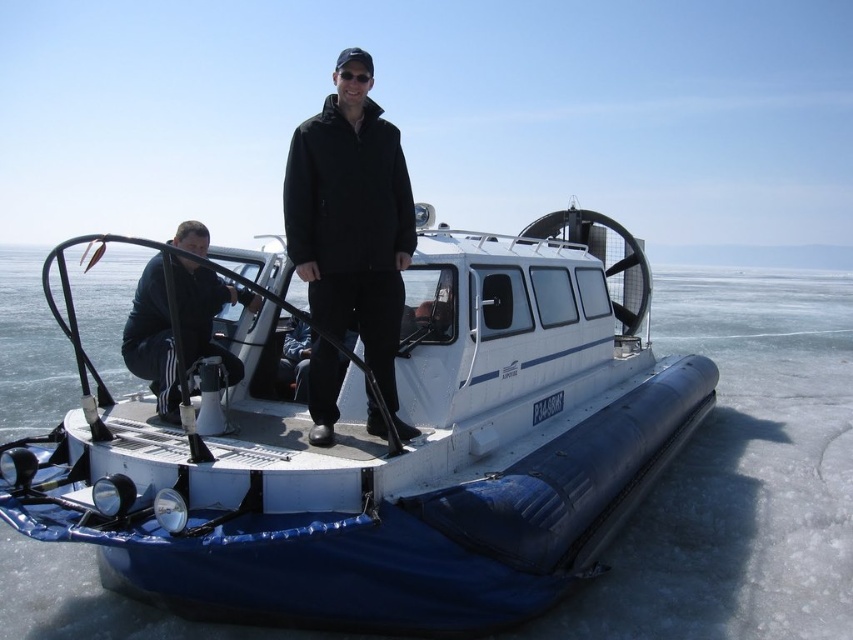
Question: Is black matte jacket at center smaller than black matte jacket at lower left?

Choices:
 (A) no
 (B) yes

Answer: (B)

Question: Which of the following is the farthest from the observer?

Choices:
 (A) black matte jacket at center
 (B) white rubber hovercraft at center

Answer: (B)

Question: Estimate the real-world distances between objects in this image. Which object is farther from the white rubber hovercraft at center?

Choices:
 (A) black matte jacket at center
 (B) black matte jacket at lower left

Answer: (A)

Question: Can you confirm if white rubber hovercraft at center is thinner than black matte jacket at lower left?

Choices:
 (A) yes
 (B) no

Answer: (A)

Question: Which of the following is the closest to the observer?

Choices:
 (A) white rubber hovercraft at center
 (B) black matte jacket at lower left

Answer: (B)

Question: Is black matte jacket at center smaller than black matte jacket at lower left?

Choices:
 (A) yes
 (B) no

Answer: (A)